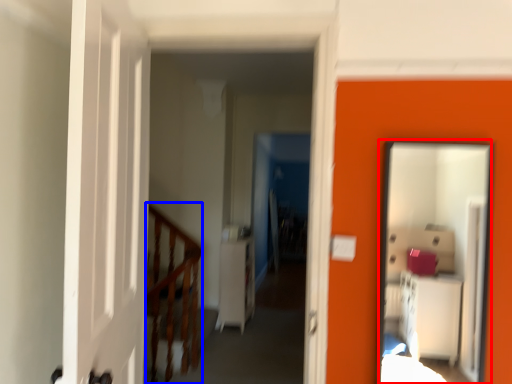
Question: Which object appears farthest to the camera in this image, mirror (highlighted by a red box) or rail (highlighted by a blue box)?

Choices:
 (A) mirror
 (B) rail

Answer: (B)